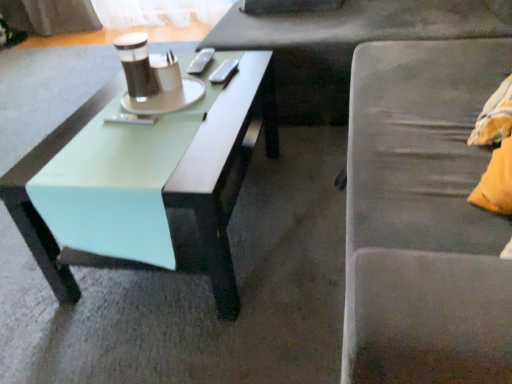
Identify the location of free space behind matte black remote control at center, positioned as the third remote control in right-to-left order. The height and width of the screenshot is (384, 512). (139, 104).